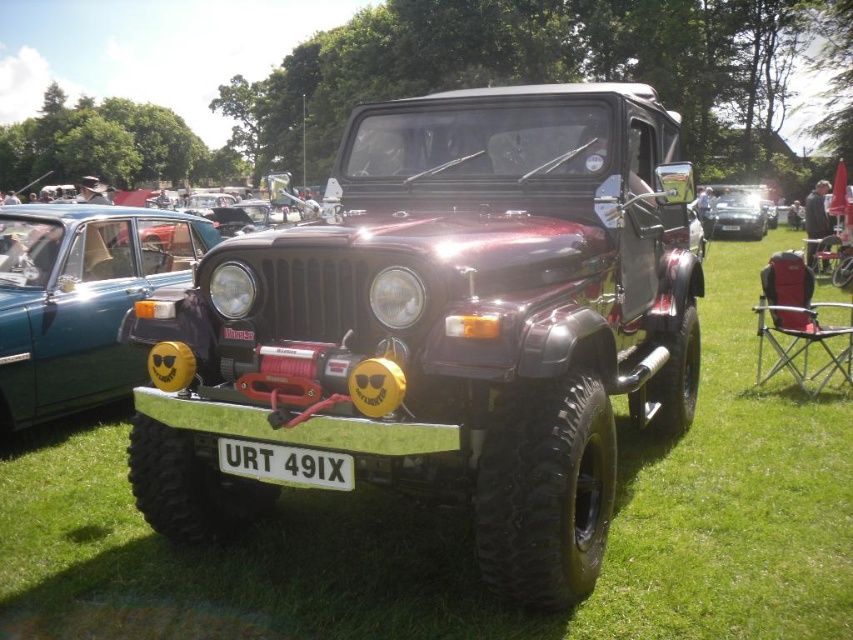
You are a photographer planning to take a series of shots of the metallic blue car at left and the satin black car at center. Considering their heights, which car should you position closer to the camera to ensure both appear proportionally sized in the final image?

The metallic blue car at left has a greater height compared to the satin black car at center. To ensure both appear proportionally sized in the final image, position the shorter satin black car at center closer to the camera since it needs to be magnified more to match the height of the taller metallic blue car at left in the photo.

You are standing in front of the Jeep and see the metallic blue car at left and the satin black car at center. Which car is located to the left of the other?

The metallic blue car at left is positioned on the left side of the satin black car at center.

You are a car designer evaluating the Jeep. You need to compare the size of the white plastic license plate at center and the satin black car at center. Which one is wider?

The white plastic license plate at center is wider than the satin black car at center.